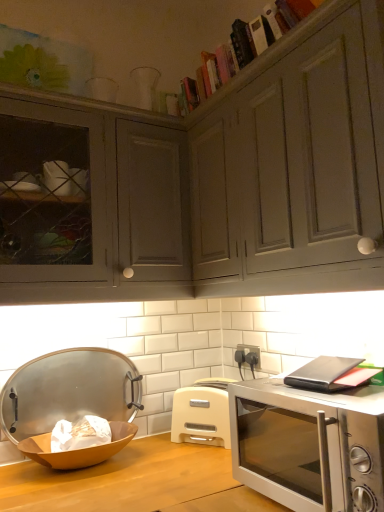
Question: Does wooden bowl at lower left appear on the right side of metallic silver tray at left?

Choices:
 (A) no
 (B) yes

Answer: (B)

Question: Does wooden bowl at lower left have a smaller size compared to metallic silver tray at left?

Choices:
 (A) yes
 (B) no

Answer: (A)

Question: Considering the relative sizes of wooden bowl at lower left and metallic silver tray at left in the image provided, is wooden bowl at lower left wider than metallic silver tray at left?

Choices:
 (A) no
 (B) yes

Answer: (B)

Question: From the image's perspective, is wooden bowl at lower left located beneath metallic silver tray at left?

Choices:
 (A) no
 (B) yes

Answer: (B)

Question: Does wooden bowl at lower left have a lesser width compared to metallic silver tray at left?

Choices:
 (A) yes
 (B) no

Answer: (B)

Question: Is point (46, 399) positioned closer to the camera than point (46, 449)?

Choices:
 (A) farther
 (B) closer

Answer: (A)

Question: From a real-world perspective, is metallic silver tray at left above or below wooden bowl at lower left?

Choices:
 (A) below
 (B) above

Answer: (B)

Question: In terms of height, does metallic silver tray at left look taller or shorter compared to wooden bowl at lower left?

Choices:
 (A) tall
 (B) short

Answer: (A)

Question: Based on their positions, is metallic silver tray at left located to the left or right of wooden bowl at lower left?

Choices:
 (A) right
 (B) left

Answer: (B)

Question: Relative to metallic silver tray at left, is wooden bowl at lower left in front or behind?

Choices:
 (A) behind
 (B) front

Answer: (B)

Question: Is point (31, 441) positioned closer to the camera than point (107, 357)?

Choices:
 (A) farther
 (B) closer

Answer: (B)

Question: Is wooden bowl at lower left bigger or smaller than metallic silver tray at left?

Choices:
 (A) big
 (B) small

Answer: (B)

Question: Is wooden bowl at lower left spatially inside metallic silver tray at left, or outside of it?

Choices:
 (A) outside
 (B) inside

Answer: (A)

Question: Does point (311, 59) appear closer or farther from the camera than point (228, 402)?

Choices:
 (A) closer
 (B) farther

Answer: (A)

Question: From the image's perspective, relative to silver metallic microwave oven at lower right, is matte gray cabinet at upper center above or below?

Choices:
 (A) below
 (B) above

Answer: (B)